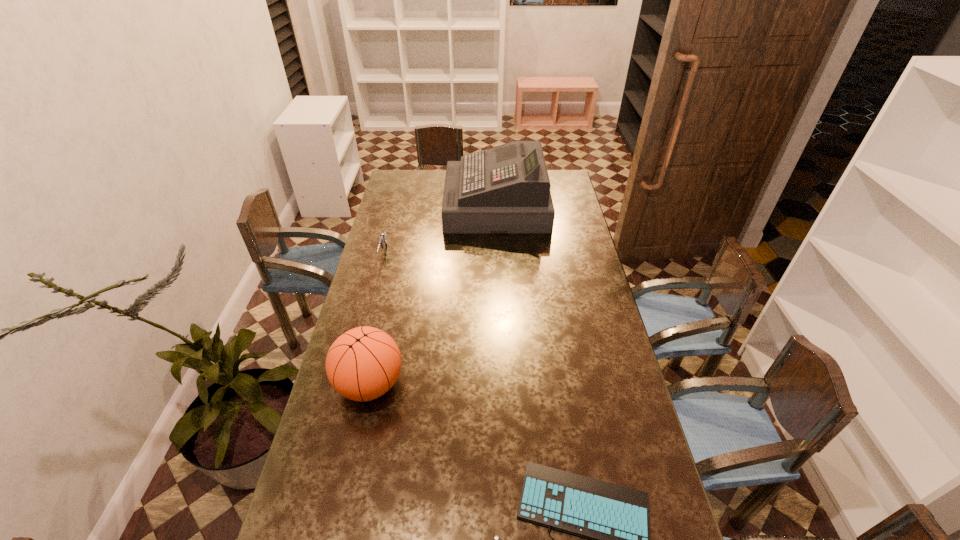
Identify the location of vacant space located 0.300m at the barrel of the third nearest object. (366, 324).

I want to click on object that is at the far edge, so click(x=505, y=189).

At what (x,y) coordinates should I click in order to perform the action: click on basketball at the left edge. Please return your answer as a coordinate pair (x, y). Looking at the image, I should click on (362, 364).

Identify the location of gun present at the left edge. The image size is (960, 540). (382, 240).

This screenshot has width=960, height=540. I want to click on object positioned at the right edge, so click(x=505, y=189).

Identify the location of object located at the far right corner. (505, 189).

Where is `free spot at the left edge of the desktop`? The image size is (960, 540). free spot at the left edge of the desktop is located at coordinates (420, 200).

The image size is (960, 540). In order to click on vacant space at the right edge of the desktop in this screenshot , I will do `click(566, 207)`.

The height and width of the screenshot is (540, 960). What are the coordinates of `free spot at the far right corner of the desktop` in the screenshot? It's located at (565, 184).

Where is `empty space between the cash register and the gun`? empty space between the cash register and the gun is located at coordinates (440, 230).